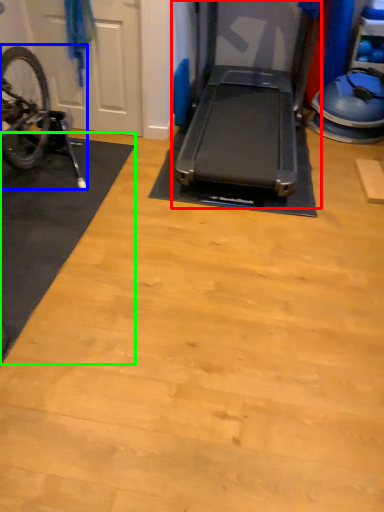
Question: Which object is positioned closest to treadmill (highlighted by a red box)? Select from bicycle (highlighted by a blue box) and mat (highlighted by a green box).

Choices:
 (A) bicycle
 (B) mat

Answer: (B)